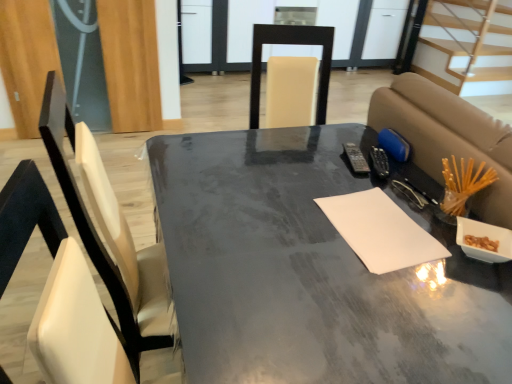
Find the location of a particular element. This screenshot has width=512, height=384. free point to the left of white paper at center is located at coordinates (288, 226).